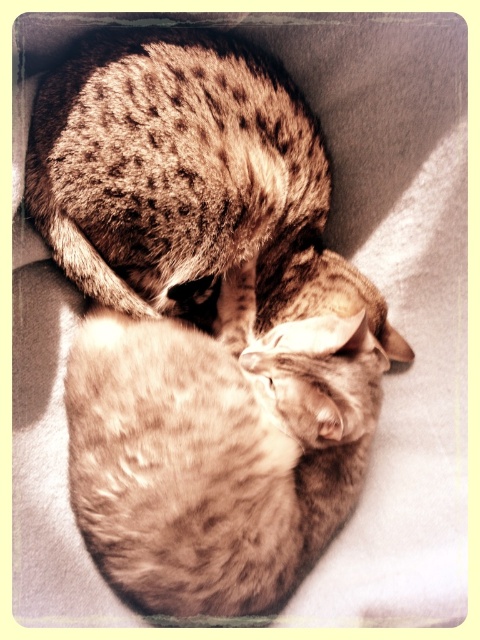
Which is below, spotted fur cat at center or spotted fur cat at upper center?

Positioned lower is spotted fur cat at center.

This screenshot has height=640, width=480. I want to click on spotted fur cat at center, so click(x=224, y=442).

This screenshot has width=480, height=640. Identify the location of spotted fur cat at center. (224, 442).